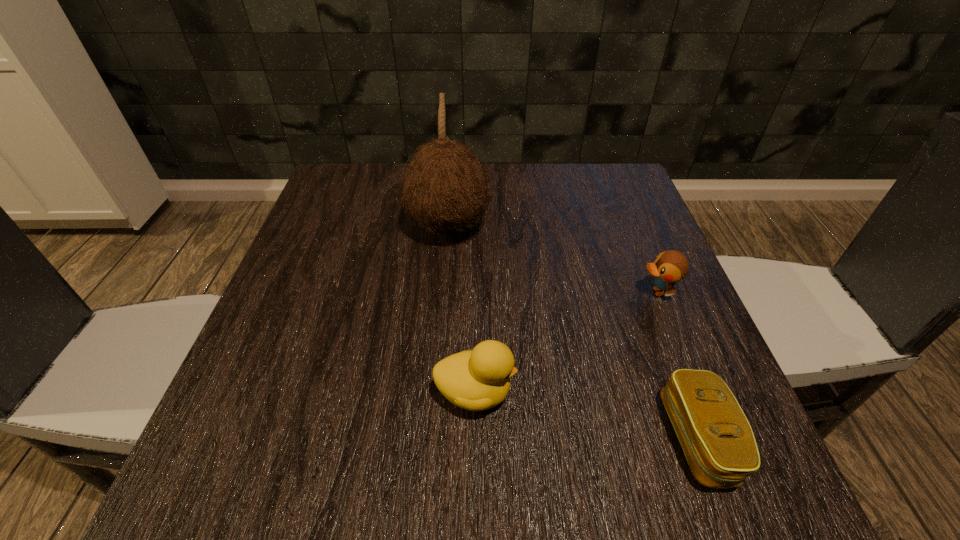
Locate an element on the screen. This screenshot has height=540, width=960. coconut is located at coordinates (445, 188).

What are the coordinates of `the farthest object` in the screenshot? It's located at (445, 188).

Locate an element on the screen. This screenshot has width=960, height=540. the nearer duck is located at coordinates (479, 379).

You are a GUI agent. You are given a task and a screenshot of the screen. Output one action in this format:
    pyautogui.click(x=<x>, y=<y>)
    Task: Click on the third shortest object
    The height and width of the screenshot is (540, 960).
    Given the screenshot: What is the action you would take?
    pyautogui.click(x=479, y=379)

Where is `the shorter duck`? the shorter duck is located at coordinates (669, 267).

I want to click on the second shortest object, so click(669, 267).

Find the location of a particular element. This screenshot has height=540, width=960. clutch bag is located at coordinates (718, 442).

Image resolution: width=960 pixels, height=540 pixels. I want to click on vacant area situated 0.110m on the surface of the tallest object, so click(540, 226).

At what (x,y) coordinates should I click in order to perform the action: click on vacant space located on the front-facing side of the second tallest object. Please return your answer as a coordinate pair (x, y). Image resolution: width=960 pixels, height=540 pixels. Looking at the image, I should click on (716, 393).

I want to click on vacant space located on the front-facing side of the farther duck, so click(x=469, y=292).